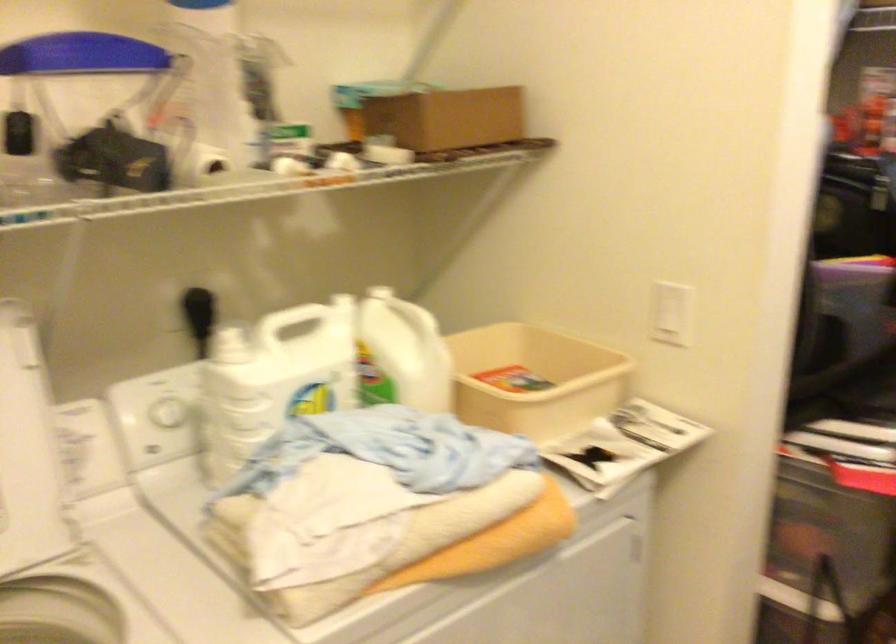
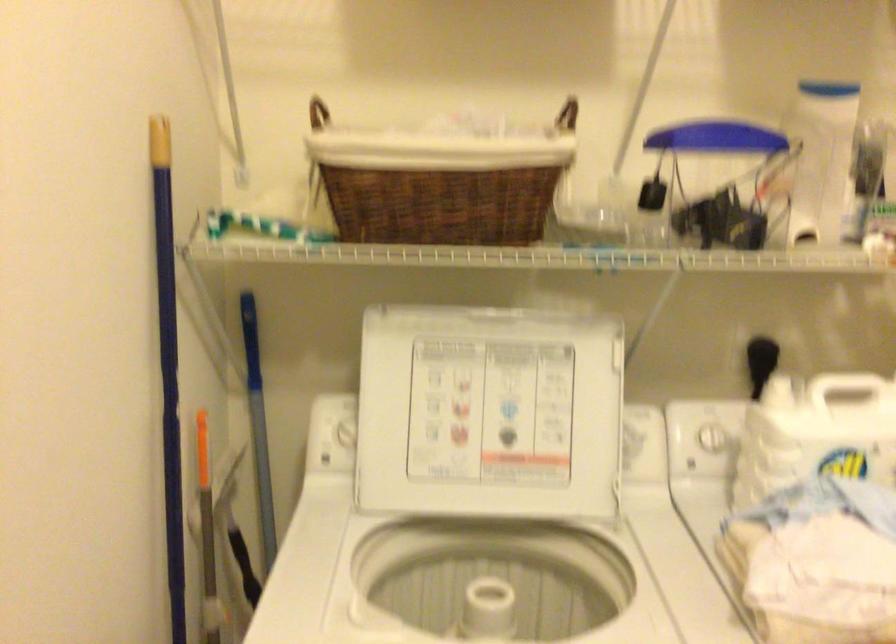
Where in the second image is the point corresponding to pixel 205 80 from the first image?

(821, 158)